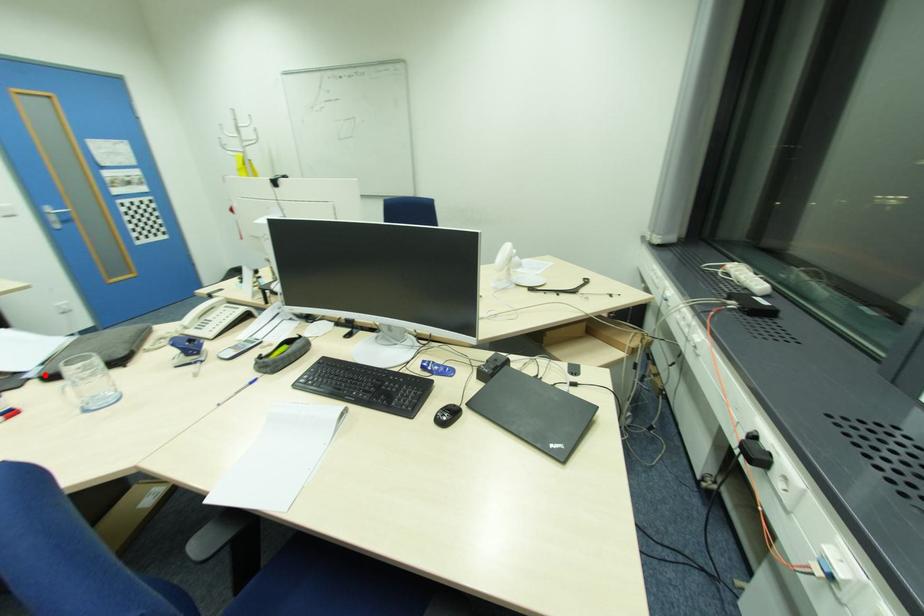
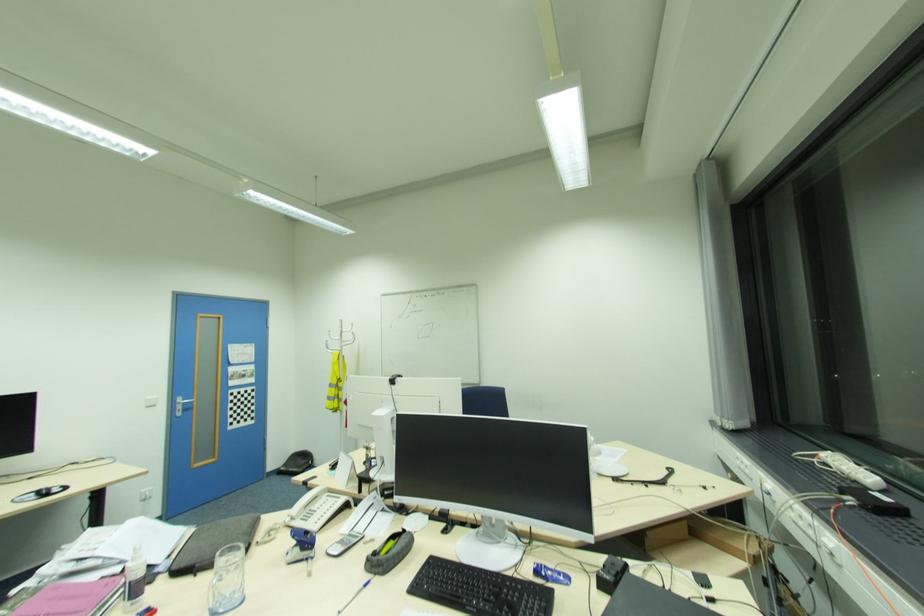
Locate, in the second image, the point that corresponds to the highlighted location in the first image.

(177, 568)